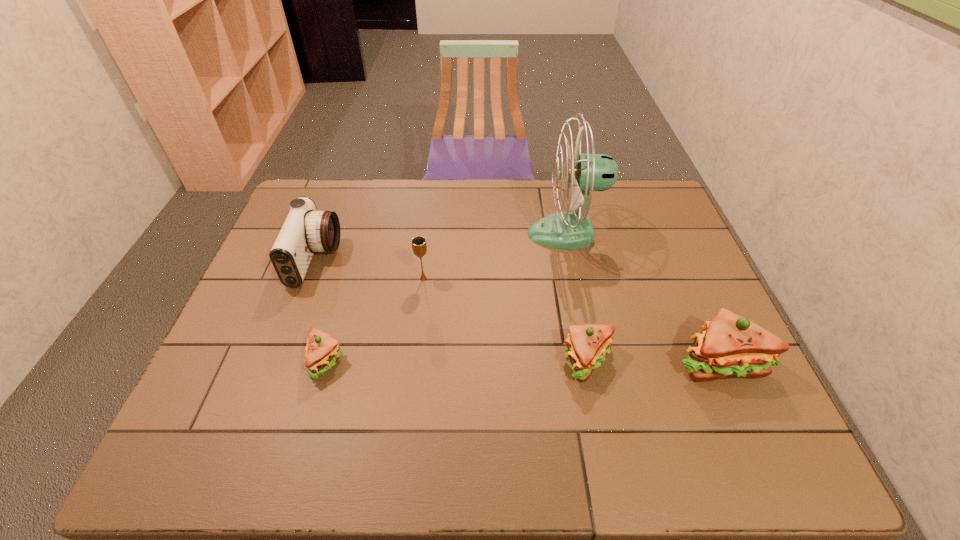
Identify which sandwich is the closest to the tallest sandwich. Please provide its 2D coordinates. Your answer should be formatted as a tuple, i.e. [(x, y)], where the tuple contains the x and y coordinates of a point satisfying the conditions above.

[(587, 345)]

This screenshot has width=960, height=540. Find the location of `vacant area that satisfies the following two spatial constraints: 1. on the back side of the leftmost sandwich; 2. on the left side of the fourth object from right to left`. vacant area that satisfies the following two spatial constraints: 1. on the back side of the leftmost sandwich; 2. on the left side of the fourth object from right to left is located at coordinates (349, 279).

The width and height of the screenshot is (960, 540). What are the coordinates of `blank space that satisfies the following two spatial constraints: 1. on the surface of the leftmost sandwich; 2. on the left side of the camcorder` in the screenshot? It's located at (278, 361).

Locate an element on the screen. This screenshot has width=960, height=540. vacant region that satisfies the following two spatial constraints: 1. on the front side of the second object from left to right; 2. on the left side of the tallest sandwich is located at coordinates (325, 362).

I want to click on vacant position in the image that satisfies the following two spatial constraints: 1. on the surface of the fifth object from right to left; 2. on the left side of the camcorder, so click(x=278, y=361).

The width and height of the screenshot is (960, 540). Find the location of `vacant position in the image that satisfies the following two spatial constraints: 1. on the surface of the second tallest sandwich; 2. on the left side of the camcorder`. vacant position in the image that satisfies the following two spatial constraints: 1. on the surface of the second tallest sandwich; 2. on the left side of the camcorder is located at coordinates (278, 362).

Identify the location of vacant space that satisfies the following two spatial constraints: 1. on the surface of the leftmost object; 2. on the left side of the leftmost sandwich. This screenshot has width=960, height=540. (278, 361).

Find the location of `vacant space that satisfies the following two spatial constraints: 1. on the back side of the chalice; 2. on the surface of the camcorder`. vacant space that satisfies the following two spatial constraints: 1. on the back side of the chalice; 2. on the surface of the camcorder is located at coordinates (425, 260).

I want to click on vacant position in the image that satisfies the following two spatial constraints: 1. on the surface of the tallest sandwich; 2. on the right side of the camcorder, so click(x=277, y=362).

Identify the location of vacant area in the image that satisfies the following two spatial constraints: 1. in front of the fan, directing airflow; 2. on the back side of the tallest sandwich. The height and width of the screenshot is (540, 960). (593, 362).